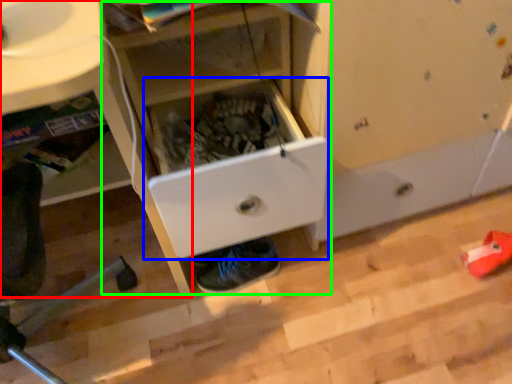
Question: Which object is positioned farthest from computer desk (highlighted by a red box)? Select from drawer (highlighted by a blue box) and cabinetry (highlighted by a green box).

Choices:
 (A) drawer
 (B) cabinetry

Answer: (A)